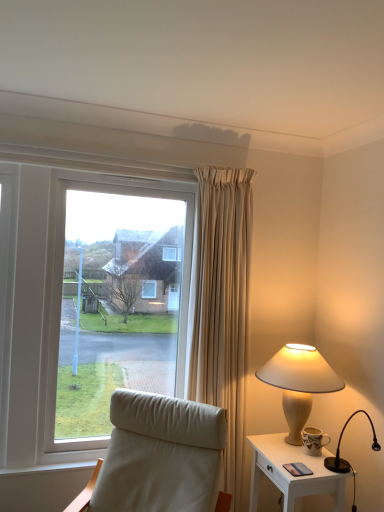
Question: From the image's perspective, is black glossy lamp at right, placed as the 2th lamp when sorted from back to front, located above or below white glossy nightstand at lower right?

Choices:
 (A) below
 (B) above

Answer: (B)

Question: In the image, is black glossy lamp at right, which is the first lamp in front-to-back order, positioned in front of or behind white glossy nightstand at lower right?

Choices:
 (A) front
 (B) behind

Answer: (A)

Question: Estimate the real-world distances between objects in this image. Which object is farther from the matte beige lamp at right, which ranks as the 2th lamp in front-to-back order?

Choices:
 (A) white glossy nightstand at lower right
 (B) leather-like chair at lower left
 (C) black glossy lamp at right, placed as the 2th lamp when sorted from back to front

Answer: (B)

Question: Considering the real-world distances, which object is farthest from the white glossy nightstand at lower right?

Choices:
 (A) black glossy lamp at right, placed as the 2th lamp when sorted from back to front
 (B) matte beige lamp at right, which ranks as the 2th lamp in front-to-back order
 (C) leather-like chair at lower left

Answer: (C)